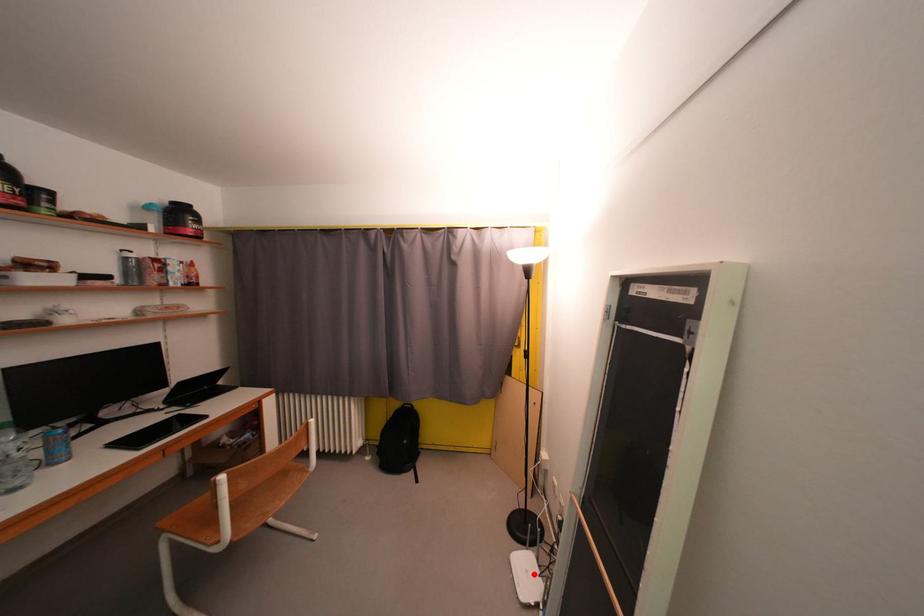
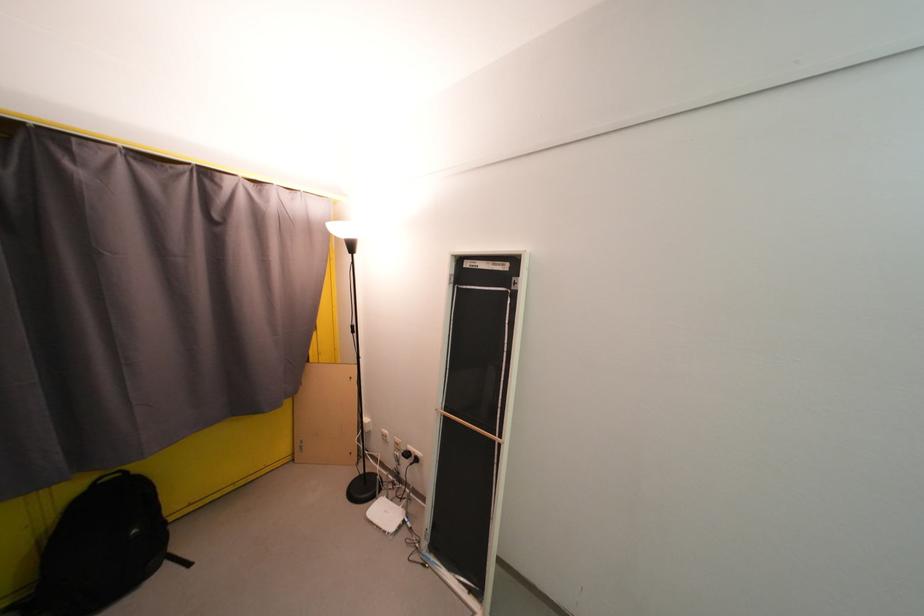
Question: I am providing you with two images of the same scene from different viewpoints. Given a red point in image1, look at the same physical point in image2. Is it:

Choices:
 (A) Closer to the viewpoint
 (B) Farther from the viewpoint

Answer: (B)